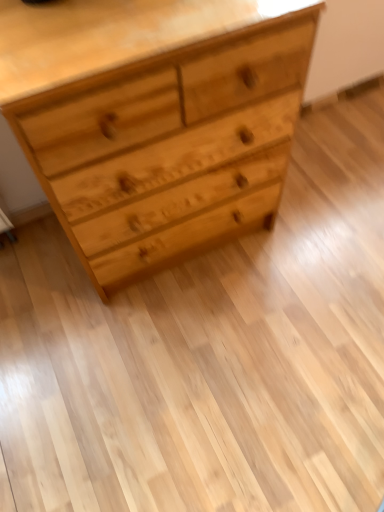
At what (x,y) coordinates should I click in order to perform the action: click on free spot in front of natural wood chest of drawers at upper center. Please return your answer as a coordinate pair (x, y). This screenshot has width=384, height=512. Looking at the image, I should click on (182, 360).